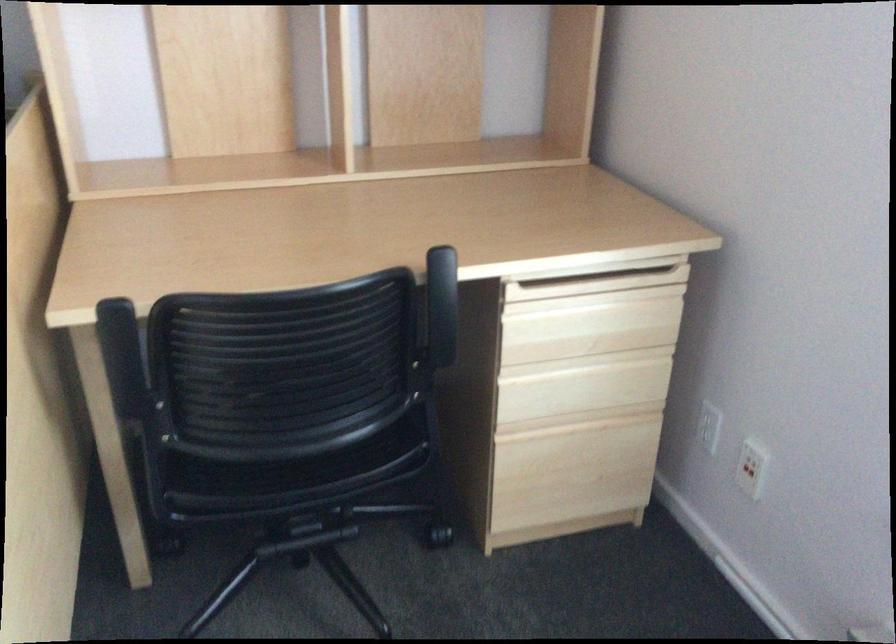
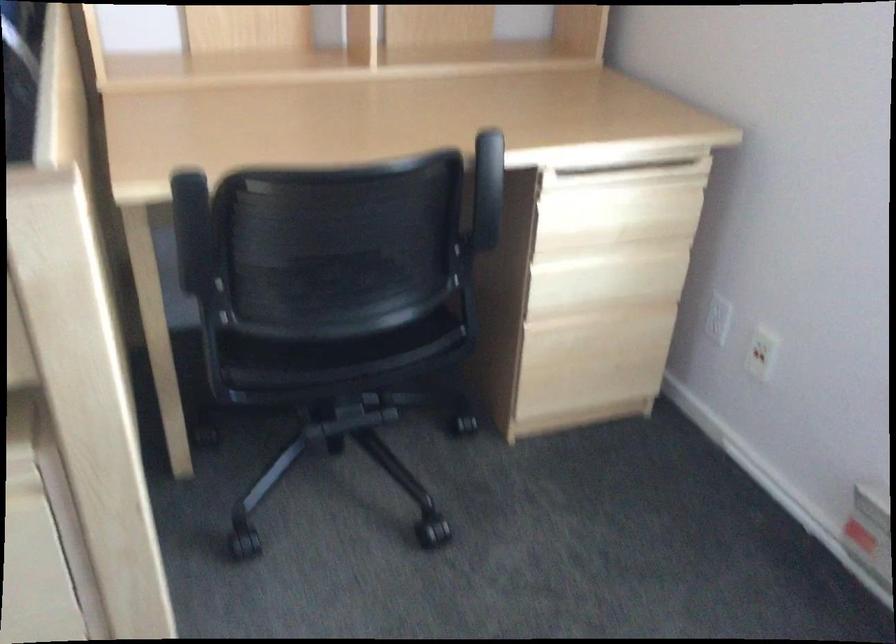
Question: Based on the continuous images, in which direction is the camera rotating? Reply with the corresponding letter.

Choices:
 (A) Left
 (B) Right
 (C) Up
 (D) Down

Answer: (D)